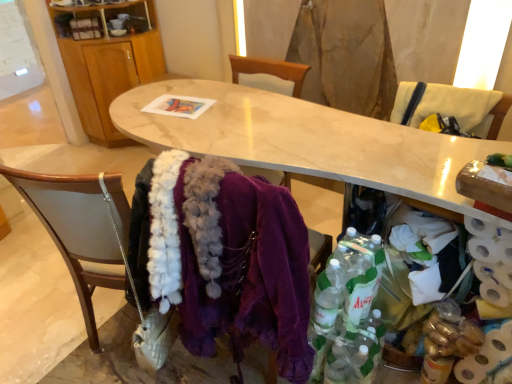
The image size is (512, 384). Identify the location of free point above marble table at center (from a real-world perspective). (287, 130).